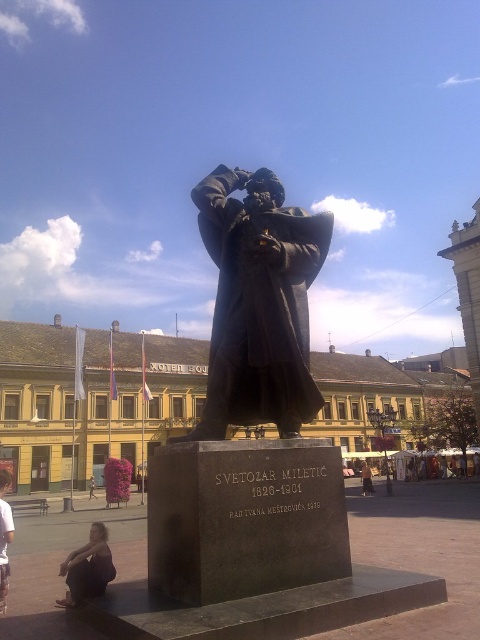
You are a visitor standing in the public square and want to sit down to rest. There are two options available to you, the bronze statue at center and the light brown wooden bench at center. Which one is more suitable for sitting?

The light brown wooden bench at center is more suitable for sitting because the bronze statue at center is larger in size than the bench, but statues are typically not meant for sitting. However, benches are designed for sitting.

You are an architect designing a new plaza and want to place a new bench between the yellow painted building at center and the bronze statue at center. If the bench requires a minimum of 3 meters of space to fit, can you determine if there is enough space between them based on their widths?

The yellow painted building at center is wider than the bronze statue at center. However, the exact widths are not provided, so it is impossible to determine if there is enough space for the bench requiring 3 meters.

You are standing in the public square where the bronze statue is located. You want to take a photo of the statue but need to ensure you are close enough to capture the inscription on the base clearly. The minimum distance required to read the inscription is 100 meters. Is your current position at point (367,465) suitable for taking the photo?

The point at (367,465) is 110.08 meters away from the camera, which is beyond the minimum required distance of 100 meters to read the inscription. Therefore, you are far enough to capture the inscription clearly.